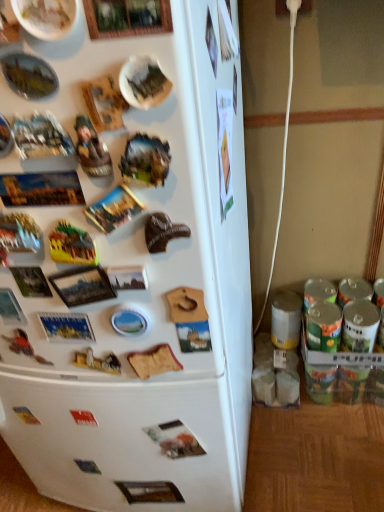
Image resolution: width=384 pixels, height=512 pixels. What do you see at coordinates (136, 278) in the screenshot?
I see `white matte refrigerator at left` at bounding box center [136, 278].

Where is `white matte refrigerator at left`? The height and width of the screenshot is (512, 384). white matte refrigerator at left is located at coordinates (136, 278).

Where is `wooden figurine at upper left`? wooden figurine at upper left is located at coordinates (91, 149).

The image size is (384, 512). Describe the element at coordinates (91, 149) in the screenshot. I see `wooden figurine at upper left` at that location.

What is the approximate width of wooden figurine at upper left?

The width of wooden figurine at upper left is 0.86 inches.

The height and width of the screenshot is (512, 384). I want to click on white matte refrigerator at left, so click(136, 278).

In the scene shown: Would you say white matte refrigerator at left is to the left or to the right of wooden figurine at upper left in the picture?

From the image, it's evident that white matte refrigerator at left is to the left of wooden figurine at upper left.

Which object is further away from the camera, white matte refrigerator at left or wooden figurine at upper left?

wooden figurine at upper left is more distant.

From the picture: Which point is more forward, (211, 308) or (100, 176)?

The point (100, 176) is closer.

From the image's perspective, which object appears higher, white matte refrigerator at left or wooden figurine at upper left?

From the image's view, wooden figurine at upper left is above.

From a real-world perspective, which is physically below, white matte refrigerator at left or wooden figurine at upper left?

white matte refrigerator at left.

Considering the relative sizes of white matte refrigerator at left and wooden figurine at upper left in the image provided, is white matte refrigerator at left wider than wooden figurine at upper left?

Yes, white matte refrigerator at left is wider than wooden figurine at upper left.

Between white matte refrigerator at left and wooden figurine at upper left, which one has less height?

wooden figurine at upper left is shorter.

Who is bigger, white matte refrigerator at left or wooden figurine at upper left?

With larger size is white matte refrigerator at left.

Is white matte refrigerator at left completely or partially outside of wooden figurine at upper left?

Yes.

Is white matte refrigerator at left with wooden figurine at upper left?

No, white matte refrigerator at left is not touching wooden figurine at upper left.

Could you tell me if white matte refrigerator at left is facing wooden figurine at upper left?

Yes, white matte refrigerator at left faces towards wooden figurine at upper left.

How different are the orientations of white matte refrigerator at left and wooden figurine at upper left in degrees?

The angular difference between white matte refrigerator at left and wooden figurine at upper left is 6.19 degrees.

How far apart are white matte refrigerator at left and wooden figurine at upper left?

17.18 inches.

The image size is (384, 512). In order to click on toy above the white matte refrigerator at left (from the image's perspective) in this screenshot , I will do `click(91, 149)`.

Considering the relative positions of wooden figurine at upper left and white matte refrigerator at left in the image provided, is wooden figurine at upper left to the left of white matte refrigerator at left from the viewer's perspective?

Incorrect, wooden figurine at upper left is not on the left side of white matte refrigerator at left.

In the image, is wooden figurine at upper left positioned in front of or behind white matte refrigerator at left?

wooden figurine at upper left is positioned farther from the viewer than white matte refrigerator at left.

Does point (100, 145) come in front of point (58, 168)?

Yes.

From the image's perspective, does wooden figurine at upper left appear lower than white matte refrigerator at left?

No.

From a real-world perspective, who is located lower, wooden figurine at upper left or white matte refrigerator at left?

white matte refrigerator at left, from a real-world perspective.

Which object is wider, wooden figurine at upper left or white matte refrigerator at left?

Wider between the two is white matte refrigerator at left.

Is wooden figurine at upper left taller or shorter than white matte refrigerator at left?

wooden figurine at upper left is shorter than white matte refrigerator at left.

Considering the relative sizes of wooden figurine at upper left and white matte refrigerator at left in the image provided, is wooden figurine at upper left bigger than white matte refrigerator at left?

Incorrect, wooden figurine at upper left is not larger than white matte refrigerator at left.

Is wooden figurine at upper left not within white matte refrigerator at left?

No, wooden figurine at upper left is inside or overlapping with white matte refrigerator at left.

Is wooden figurine at upper left not close to white matte refrigerator at left?

wooden figurine at upper left is actually quite close to white matte refrigerator at left.

Could you tell me if wooden figurine at upper left is facing white matte refrigerator at left?

Yes, wooden figurine at upper left is turned towards white matte refrigerator at left.

Identify the location of refrigerator located underneath the wooden figurine at upper left (from a real-world perspective). This screenshot has height=512, width=384. (136, 278).

The width and height of the screenshot is (384, 512). I want to click on toy on the right of the white matte refrigerator at left, so click(x=91, y=149).

Find the location of a particular element. Image resolution: width=384 pixels, height=512 pixels. refrigerator that appears below the wooden figurine at upper left (from a real-world perspective) is located at coordinates (136, 278).